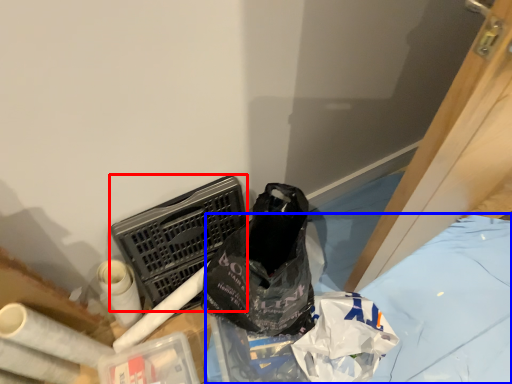
Question: Among these objects, which one is nearest to the camera, laundry basket (highlighted by a red box) or sheet (highlighted by a blue box)?

Choices:
 (A) laundry basket
 (B) sheet

Answer: (A)